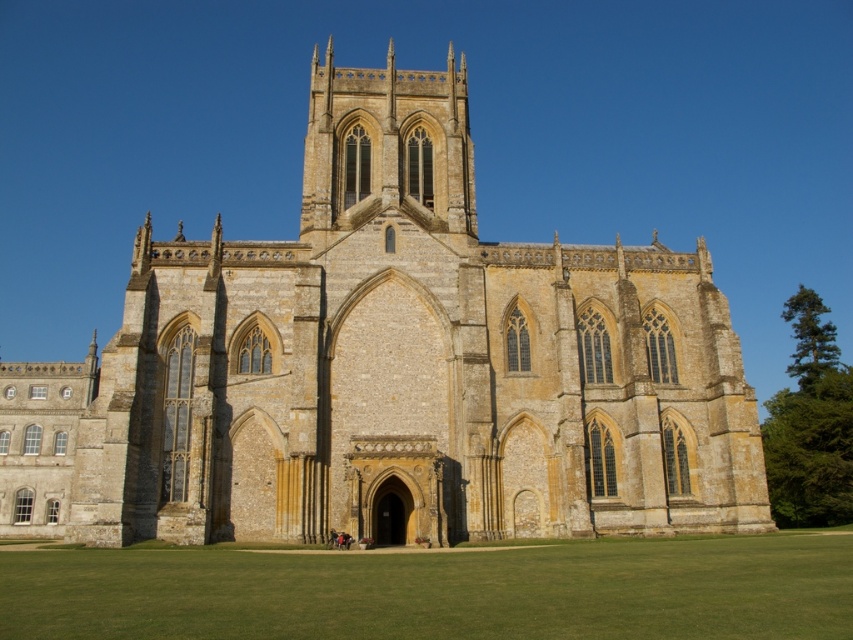
Based on the photo, you are standing in front of the yellow stone church at center and the green grass at center. Which object is higher in elevation?

The yellow stone church at center is located above the green grass at center, so it is higher in elevation.

You are a construction worker planning to install a new walkway between the yellow stone church at center and the green grass at center. The walkway must be exactly 20 meters long. Based on the scene description, will the walkway fit between them without needing adjustments?

The distance between the yellow stone church at center and the green grass at center is 22.10 meters. Since the walkway is only 20 meters long, it will fit with 2.10 meters of extra space remaining.